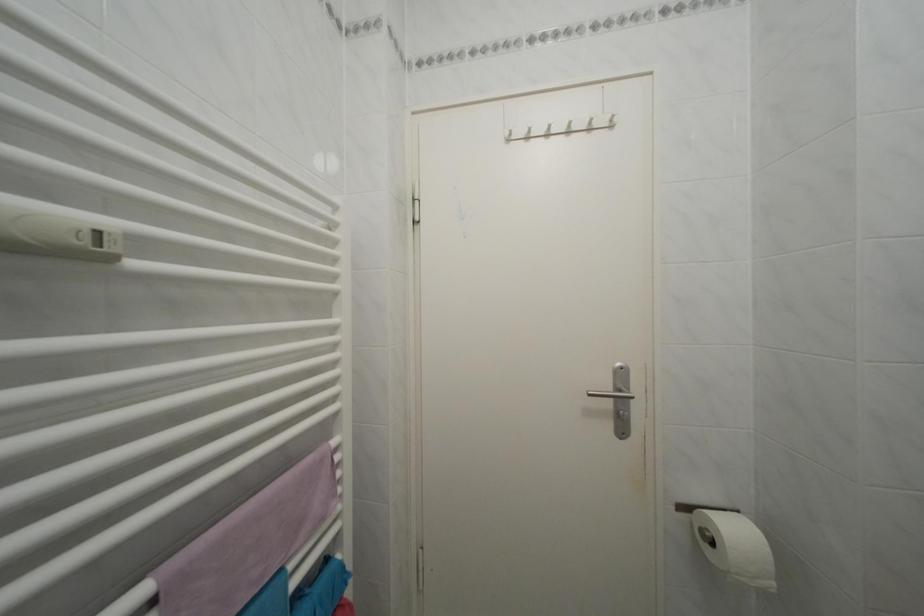
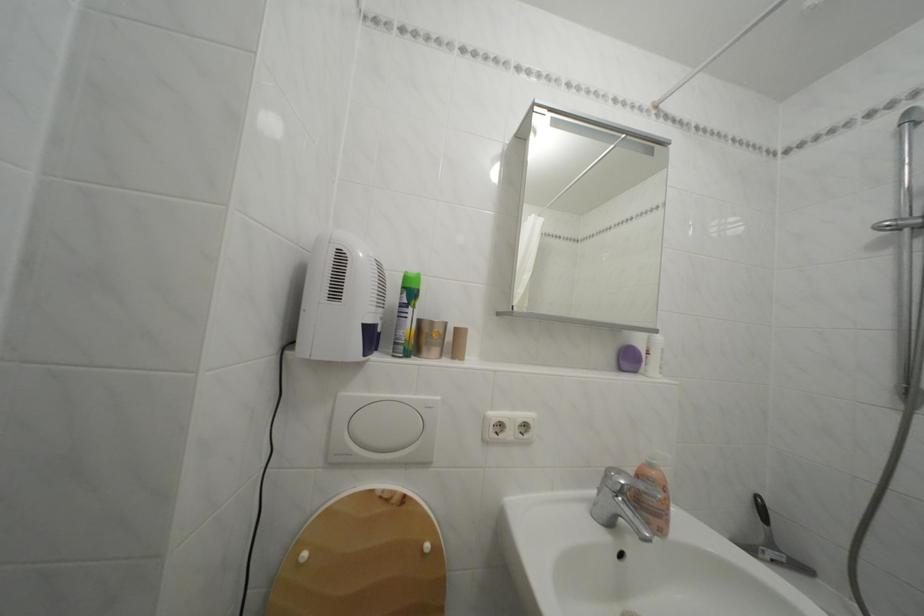
Question: How did the camera likely rotate?

Choices:
 (A) Left
 (B) Right
 (C) Up
 (D) Down

Answer: (B)